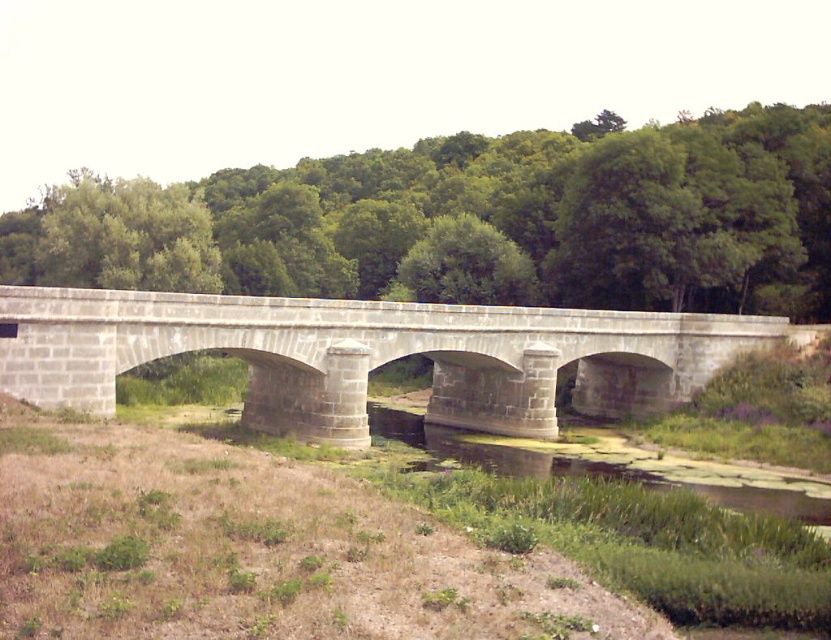
Is point (588, 278) more distant than point (770, 323)?

Yes, it is behind point (770, 323).

Measure the distance between green leafy trees at center and gray stone bridge at center.

The distance of green leafy trees at center from gray stone bridge at center is 114.26 feet.

Who is more forward, (814, 161) or (297, 358)?

Point (297, 358) is more forward.

The height and width of the screenshot is (640, 831). I want to click on green leafy trees at center, so click(x=564, y=212).